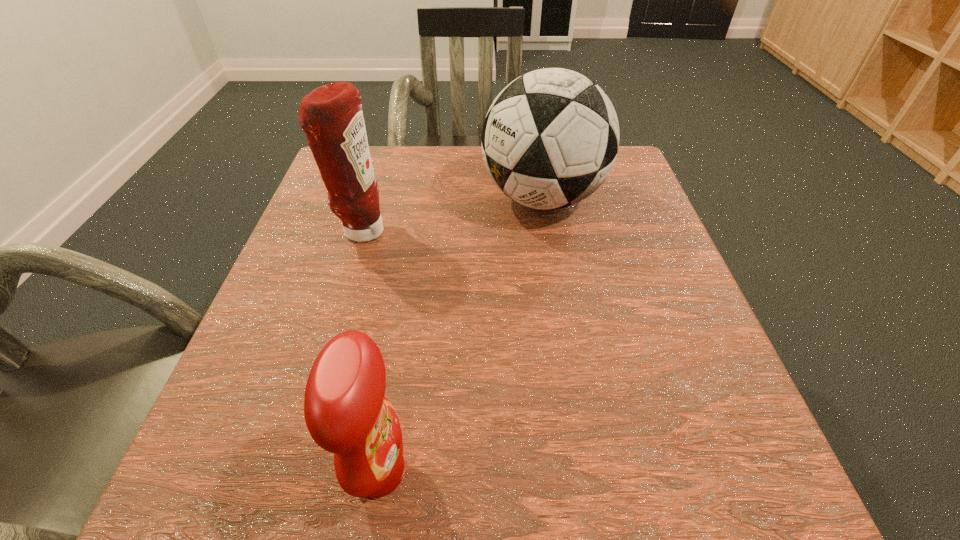
Image resolution: width=960 pixels, height=540 pixels. What are the coordinates of `empty space between the rightmost object and the shorter condiment` in the screenshot? It's located at (461, 335).

Where is `empty space between the rightmost object and the leftmost object`? The image size is (960, 540). empty space between the rightmost object and the leftmost object is located at coordinates (452, 215).

Locate an element on the screen. vacant area that lies between the soccer ball and the nearer condiment is located at coordinates (461, 335).

This screenshot has height=540, width=960. In order to click on vacant space that is in between the right condiment and the rightmost object in this screenshot , I will do `click(461, 335)`.

Where is `free point between the rightmost object and the nearest object`? The image size is (960, 540). free point between the rightmost object and the nearest object is located at coordinates (461, 335).

Image resolution: width=960 pixels, height=540 pixels. Identify the location of vacant region between the shorter condiment and the rightmost object. (461, 335).

Locate which object is the second closest to the rightmost object. Please provide its 2D coordinates. Your answer should be formatted as a tuple, i.e. [(x, y)], where the tuple contains the x and y coordinates of a point satisfying the conditions above.

[(346, 413)]

Find the location of a particular element. The width and height of the screenshot is (960, 540). object identified as the closest to the soccer ball is located at coordinates (331, 116).